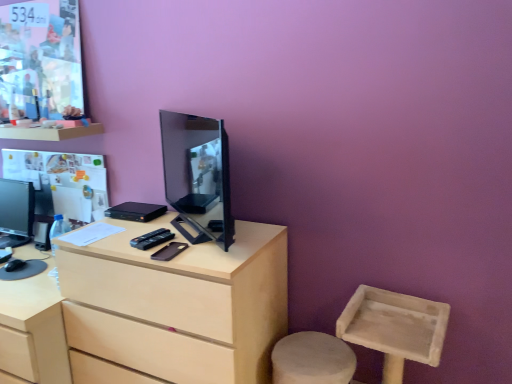
At what (x,y) coordinates should I click in order to perform the action: click on black plastic remote control at center. Please return your answer as a coordinate pair (x, y). Image resolution: width=512 pixels, height=384 pixels. Looking at the image, I should click on (152, 239).

At what (x,y) coordinates should I click in order to perform the action: click on light wood desk at center. Please return your answer as a coordinate pair (x, y). This screenshot has width=512, height=384. Looking at the image, I should click on (150, 311).

This screenshot has width=512, height=384. What do you see at coordinates (16, 212) in the screenshot?
I see `matte black monitor at left, the 1th television in the left-to-right sequence` at bounding box center [16, 212].

You are a GUI agent. You are given a task and a screenshot of the screen. Output one action in this format:
    pyautogui.click(x=<x>, y=<y>)
    Task: Click on the black plastic remote control at center
    The width and height of the screenshot is (512, 384).
    Given the screenshot: What is the action you would take?
    (152, 239)

From their relative heights in the image, would you say matte paper poster at upper left is taller or shorter than matte black monitor at left, the 1th television in the left-to-right sequence?

matte paper poster at upper left is taller than matte black monitor at left, the 1th television in the left-to-right sequence.

Based on their positions, is matte paper poster at upper left located to the left or right of matte black monitor at left, which is the 1th television from back to front?

Based on their positions, matte paper poster at upper left is located to the right of matte black monitor at left, which is the 1th television from back to front.

Considering the sizes of matte paper poster at upper left and matte black monitor at left, the 1th television in the left-to-right sequence, in the image, is matte paper poster at upper left bigger or smaller than matte black monitor at left, the 1th television in the left-to-right sequence,?

Considering their sizes, matte paper poster at upper left takes up less space than matte black monitor at left, the 1th television in the left-to-right sequence.

Where is `television on the left of matte paper poster at upper left`? This screenshot has height=384, width=512. television on the left of matte paper poster at upper left is located at coordinates coord(16,212).

Is light wood desk at center not near matte black monitor at left, the 1th television in the left-to-right sequence?

That's not correct — light wood desk at center is a little close to matte black monitor at left, the 1th television in the left-to-right sequence.

Could you tell me if light wood desk at center is facing matte black monitor at left, the 1th television in the left-to-right sequence?

No, light wood desk at center is not oriented towards matte black monitor at left, the 1th television in the left-to-right sequence.

In the scene shown: From the image's perspective, between light wood desk at center and matte black monitor at left, which is the 1th television from back to front, who is located below?

light wood desk at center is shown below in the image.

From the picture: Is light wood desk at center thinner than matte black monitor at left, which is the second television in front-to-back order?

No.

Can you confirm if matte black tv at center, arranged as the first television when viewed from the front, is wider than black matte mobile phone at center?

No.

Is matte black tv at center, marked as the second television in a back-to-front arrangement, inside the boundaries of black matte mobile phone at center, or outside?

matte black tv at center, marked as the second television in a back-to-front arrangement, cannot be found inside black matte mobile phone at center.

Does matte black tv at center, marked as the second television in a back-to-front arrangement, turn towards black matte mobile phone at center?

Yes.

Identify the location of poster page in front of the matte black monitor at left, which is the 1th television from back to front. (41, 61).

Is matte black monitor at left, which is the 1th television from back to front, taller or shorter than matte paper poster at upper left?

Clearly, matte black monitor at left, which is the 1th television from back to front, is shorter compared to matte paper poster at upper left.

Which object is further away from the camera taking this photo, matte black monitor at left, which is the 1th television from back to front, or matte paper poster at upper left?

matte black monitor at left, which is the 1th television from back to front, is further away from the camera.

Considering the sizes of light wood desk at center and matte black tv at center, marked as the second television in a back-to-front arrangement, in the image, is light wood desk at center wider or thinner than matte black tv at center, marked as the second television in a back-to-front arrangement,?

Considering their sizes, light wood desk at center looks broader than matte black tv at center, marked as the second television in a back-to-front arrangement.

Which of these two, light wood desk at center or matte black tv at center, the second television when ordered from left to right, is bigger?

Bigger between the two is light wood desk at center.

Based on the photo, what's the angular difference between light wood desk at center and matte black tv at center, which is the first television in right-to-left order,'s facing directions?

The angular difference between light wood desk at center and matte black tv at center, which is the first television in right-to-left order, is 38.7 degrees.

Considering the sizes of light wood desk at center and matte black tv at center, the second television when ordered from left to right, in the image, is light wood desk at center taller or shorter than matte black tv at center, the second television when ordered from left to right,?

Considering their sizes, light wood desk at center has more height than matte black tv at center, the second television when ordered from left to right.

Where is `television on the left of the black matte mobile phone at center`? The height and width of the screenshot is (384, 512). television on the left of the black matte mobile phone at center is located at coordinates (16, 212).

Considering the relative sizes of matte black monitor at left, which is the second television in front-to-back order, and black matte mobile phone at center in the image provided, is matte black monitor at left, which is the second television in front-to-back order, shorter than black matte mobile phone at center?

No.

Between point (16, 231) and point (177, 243), which one is positioned behind?

The point (16, 231) is farther.

Is matte black monitor at left, which is the second television in front-to-back order, next to black matte mobile phone at center?

No, matte black monitor at left, which is the second television in front-to-back order, is not in contact with black matte mobile phone at center.

Which is behind, black matte mobile phone at center or matte black tv at center, marked as the second television in a back-to-front arrangement?

Positioned behind is black matte mobile phone at center.

Between point (161, 259) and point (170, 113), which one is positioned in front?

The point (161, 259) is in front.

Is black matte mobile phone at center positioned with its back to matte black tv at center, arranged as the first television when viewed from the front?

That's not correct — black matte mobile phone at center is not looking away from matte black tv at center, arranged as the first television when viewed from the front.

Where is `television lying on the left of matte paper poster at upper left`? television lying on the left of matte paper poster at upper left is located at coordinates (16, 212).

At what (x,y) coordinates should I click in order to perform the action: click on television that is the 1st one when counting upward from the light wood desk at center (from the image's perspective). Please return your answer as a coordinate pair (x, y). This screenshot has width=512, height=384. Looking at the image, I should click on (16, 212).

When comparing their distances from matte paper poster at upper left, does matte black monitor at left, which is the second television in front-to-back order, or black matte mobile phone at center seem further?

black matte mobile phone at center is further to matte paper poster at upper left.

From the image, which object appears to be farther from matte black tv at center, the second television when ordered from left to right, light wood desk at center or black plastic remote control at center?

black plastic remote control at center.

Estimate the real-world distances between objects in this image. Which object is closer to matte black tv at center, marked as the second television in a back-to-front arrangement, black matte mobile phone at center or matte paper poster at upper left?

black matte mobile phone at center lies closer to matte black tv at center, marked as the second television in a back-to-front arrangement, than the other object.

Estimate the real-world distances between objects in this image. Which object is further from black plastic remote control at center, matte paper poster at upper left or matte black tv at center, marked as the second television in a back-to-front arrangement?

matte paper poster at upper left is further to black plastic remote control at center.

Looking at the image, which one is located closer to matte black monitor at left, which is the second television in front-to-back order, matte black tv at center, arranged as the first television when viewed from the front, or matte paper poster at upper left?

matte paper poster at upper left.

When comparing their distances from black plastic remote control at center, does matte black tv at center, which is the first television in right-to-left order, or light wood desk at center seem closer?

light wood desk at center.

Which object lies further to the anchor point matte paper poster at upper left, light wood desk at center or matte black tv at center, the second television when ordered from left to right?

Based on the image, light wood desk at center appears to be further to matte paper poster at upper left.

Estimate the real-world distances between objects in this image. Which object is closer to matte black tv at center, the second television when ordered from left to right, black plastic remote control at center or matte black monitor at left, arranged as the 2th television when viewed from the right?

The object closer to matte black tv at center, the second television when ordered from left to right, is black plastic remote control at center.

The image size is (512, 384). In order to click on remote control between matte paper poster at upper left and matte black tv at center, the second television when ordered from left to right, in the horizontal direction in this screenshot , I will do `click(152, 239)`.

Where is `desk between matte black monitor at left, which is the 1th television from back to front, and matte black tv at center, marked as the second television in a back-to-front arrangement, from left to right`? The width and height of the screenshot is (512, 384). desk between matte black monitor at left, which is the 1th television from back to front, and matte black tv at center, marked as the second television in a back-to-front arrangement, from left to right is located at coordinates (150, 311).

Where is `desk between matte black monitor at left, which is the second television in front-to-back order, and black matte mobile phone at center, in the horizontal direction`? desk between matte black monitor at left, which is the second television in front-to-back order, and black matte mobile phone at center, in the horizontal direction is located at coordinates (150, 311).

I want to click on poster page between matte black monitor at left, which is the 1th television from back to front, and matte black tv at center, marked as the second television in a back-to-front arrangement, from left to right, so click(x=41, y=61).